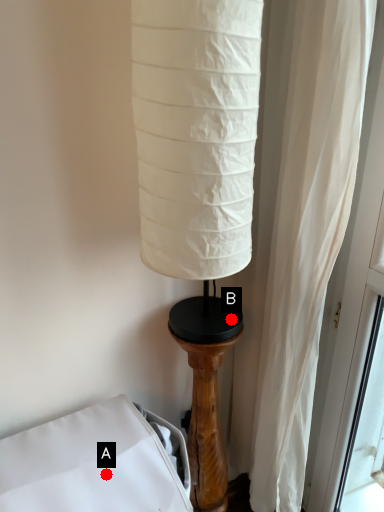
Question: Two points are circled on the image, labeled by A and B beside each circle. Which of the following is the farthest from the observer?

Choices:
 (A) A is further
 (B) B is further

Answer: (B)